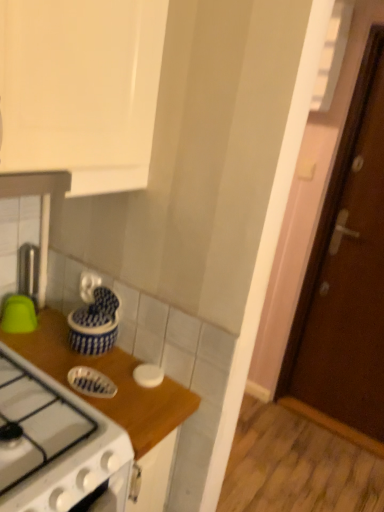
Locate an element on the screen. This screenshot has height=512, width=384. vacant space that's between blue glossy dish at center, the 3th kitchen appliance from the left, and white matte lid at center, which is counted as the first kitchen appliance, starting from the right is located at coordinates (124, 378).